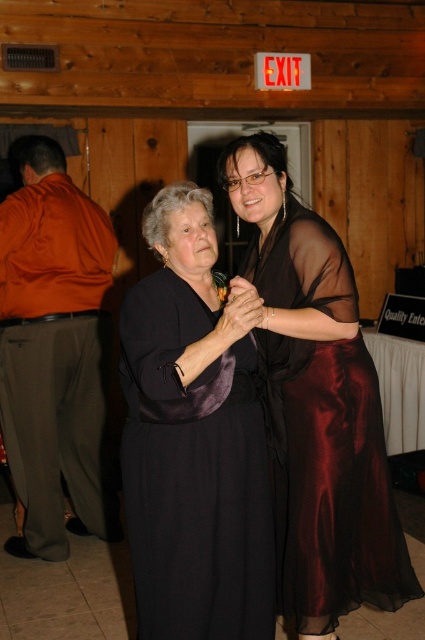
Question: Does sheer dark brown dress at center appear under orange satin robe at left?

Choices:
 (A) no
 (B) yes

Answer: (B)

Question: Does sheer dark brown dress at center appear on the left side of orange satin robe at left?

Choices:
 (A) yes
 (B) no

Answer: (B)

Question: Which point is farther from the camera taking this photo?

Choices:
 (A) (303, 388)
 (B) (240, 372)

Answer: (A)

Question: Can you confirm if satin black dress at center is wider than orange satin robe at left?

Choices:
 (A) yes
 (B) no

Answer: (B)

Question: Which of the following is the closest to the observer?

Choices:
 (A) (291, 236)
 (B) (172, 596)
 (C) (112, 276)

Answer: (B)

Question: Which object appears closest to the camera in this image?

Choices:
 (A) sheer dark brown dress at center
 (B) satin black dress at center

Answer: (B)